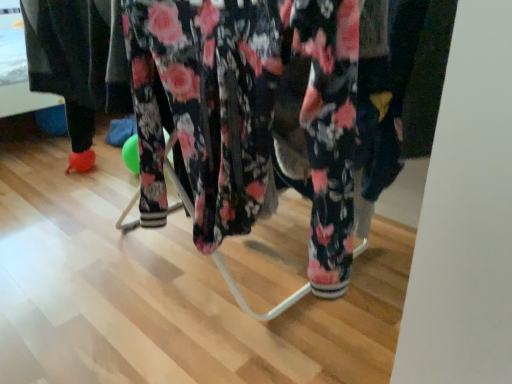
The height and width of the screenshot is (384, 512). I want to click on floral fabric pants at center, so click(x=247, y=113).

Image resolution: width=512 pixels, height=384 pixels. What do you see at coordinates (247, 113) in the screenshot? I see `floral fabric pants at center` at bounding box center [247, 113].

The width and height of the screenshot is (512, 384). I want to click on floral fabric pants at center, so [247, 113].